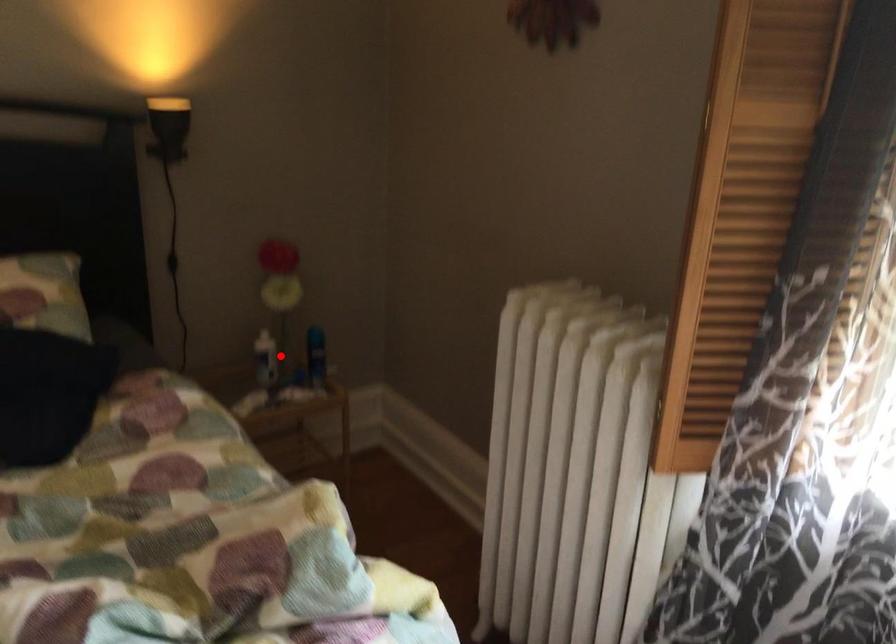
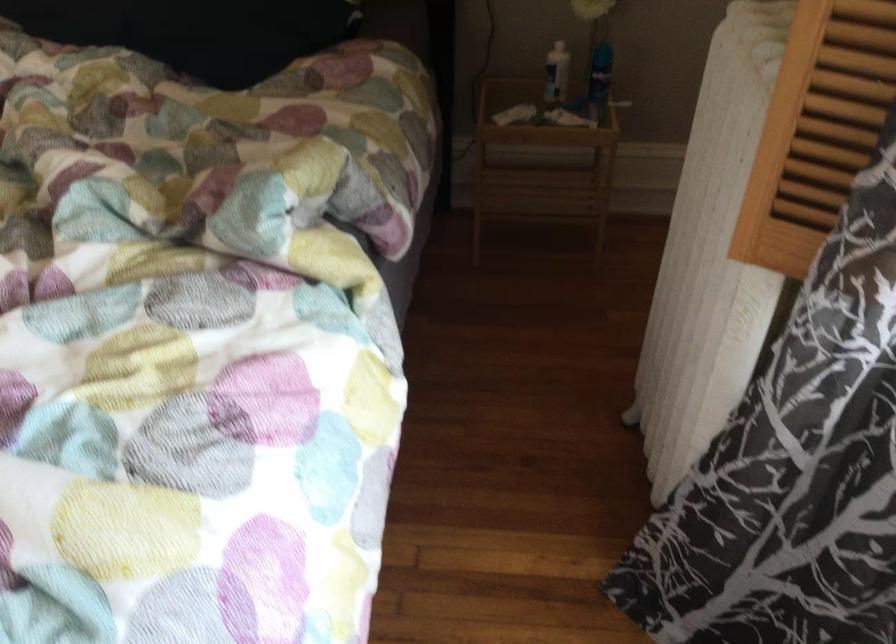
The point at the highlighted location is marked in the first image. Where is the corresponding point in the second image?

(556, 73)